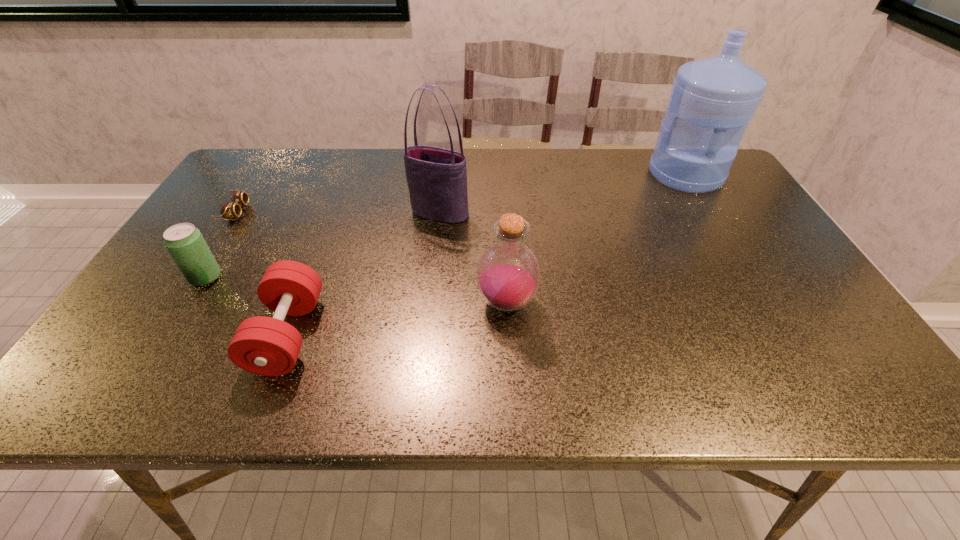
This screenshot has height=540, width=960. I want to click on vacant point located on the side of the water jug with the handle, so (x=716, y=225).

This screenshot has height=540, width=960. I want to click on vacant area situated 0.080m on the back of the second tallest object, so click(443, 187).

What are the coordinates of `free space located 0.120m on the left of the fourth shortest object` in the screenshot? It's located at point(424,303).

This screenshot has width=960, height=540. In order to click on vacant point located on the front of the soda in this screenshot , I will do `click(157, 355)`.

Locate an element on the screen. Image resolution: width=960 pixels, height=540 pixels. free space located 0.340m on the right of the fifth tallest object is located at coordinates point(474,334).

This screenshot has width=960, height=540. I want to click on vacant region located through the lenses of the shortest object, so click(382, 212).

You are a GUI agent. You are given a task and a screenshot of the screen. Output one action in this format:
    pyautogui.click(x=<x>, y=<y>)
    Task: Click on the object located at the far edge
    
    Given the screenshot: What is the action you would take?
    pyautogui.click(x=713, y=99)

Where is `object located in the near edge section of the desktop`? Image resolution: width=960 pixels, height=540 pixels. object located in the near edge section of the desktop is located at coordinates (266, 346).

Where is `soda located at the left edge`? The image size is (960, 540). soda located at the left edge is located at coordinates (185, 243).

Locate an element on the screen. goggles at the left edge is located at coordinates (228, 210).